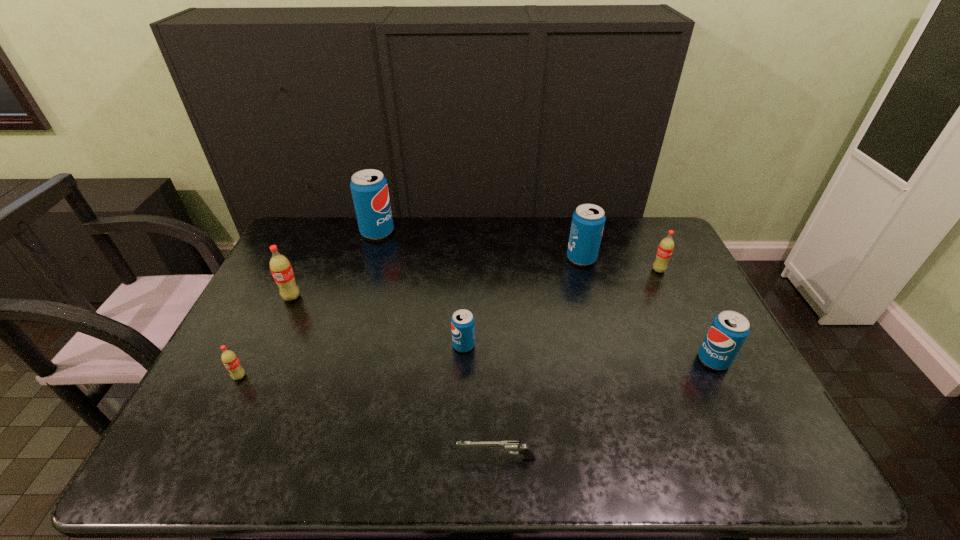
Find the location of a particular element. The height and width of the screenshot is (540, 960). free space that is in between the third blue soda can from right to left and the third smallest blue soda can is located at coordinates (522, 302).

At what (x,y) coordinates should I click in order to perform the action: click on vacant region between the tallest object and the second blue soda can from left to right. Please return your answer as a coordinate pair (x, y). The width and height of the screenshot is (960, 540). Looking at the image, I should click on [x=420, y=289].

The height and width of the screenshot is (540, 960). What are the coordinates of `vacant area that lies between the nearest red soda and the second biggest blue soda can` in the screenshot? It's located at (411, 318).

Locate an element on the screen. The image size is (960, 540). free space between the shortest object and the fourth soda from left to right is located at coordinates (480, 402).

Find the location of a particular element. free space between the rightmost red soda and the smallest red soda is located at coordinates [x=449, y=323].

Locate an element on the screen. The image size is (960, 540). empty space that is in between the rightmost red soda and the fourth soda from right to left is located at coordinates (562, 308).

Find the location of a particular element. This screenshot has width=960, height=540. free spot between the rightmost blue soda can and the fourth soda from right to left is located at coordinates (588, 353).

Find the location of a particular element. vacant region between the smallest red soda and the second smallest blue soda can is located at coordinates (476, 368).

At what (x,y) coordinates should I click in order to perform the action: click on free space between the fifth nearest object and the third object from right to left. Please return your answer as a coordinate pair (x, y). The image size is (960, 540). Looking at the image, I should click on 437,278.

The width and height of the screenshot is (960, 540). I want to click on empty location between the farthest soda and the nearest object, so click(x=437, y=345).